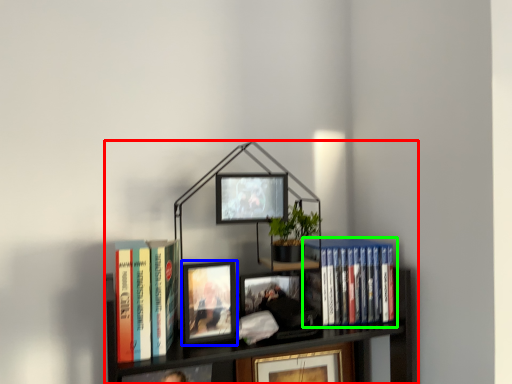
Question: Which is nearer to the bookcase (highlighted by a red box)? picture frame (highlighted by a blue box) or book (highlighted by a green box).

Choices:
 (A) picture frame
 (B) book

Answer: (B)